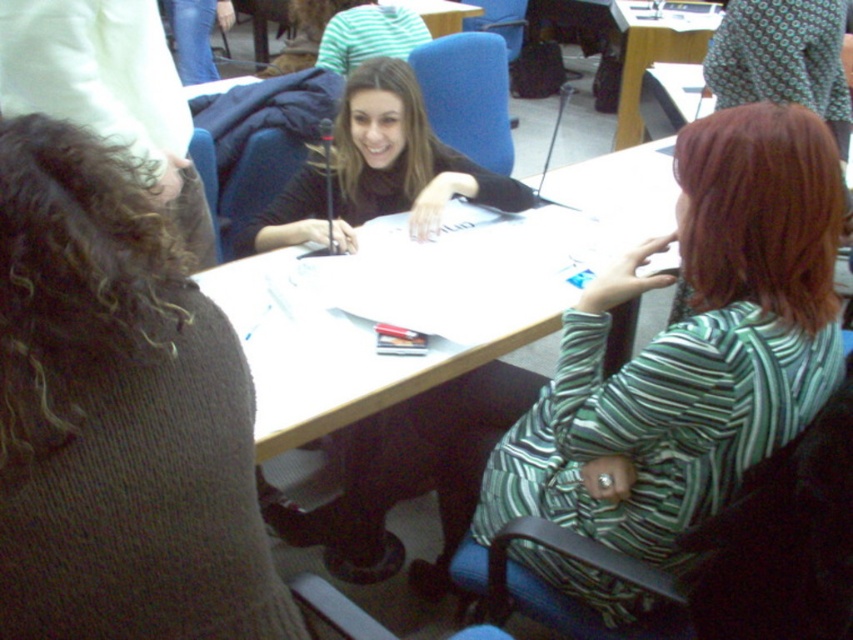
Question: Which object appears farthest from the camera in this image?

Choices:
 (A) matte black shirt at center
 (B) matte black sweater at center
 (C) knitted brown sweater at left
 (D) wooden table at upper center

Answer: (D)

Question: Which object is the farthest from the matte black shirt at center?

Choices:
 (A) green striped shirt at right
 (B) wooden table at upper center
 (C) knitted brown sweater at left
 (D) matte black sweater at center

Answer: (B)

Question: Based on their relative distances, which object is farther from the green striped shirt at right?

Choices:
 (A) wooden table at upper center
 (B) matte black sweater at center
 (C) knitted brown sweater at left

Answer: (A)

Question: Can you confirm if knitted brown sweater at left is positioned to the right of matte black shirt at center?

Choices:
 (A) no
 (B) yes

Answer: (A)

Question: Does matte black shirt at center have a smaller size compared to matte black sweater at center?

Choices:
 (A) no
 (B) yes

Answer: (A)

Question: Does matte black shirt at center appear over wooden table at upper center?

Choices:
 (A) yes
 (B) no

Answer: (B)